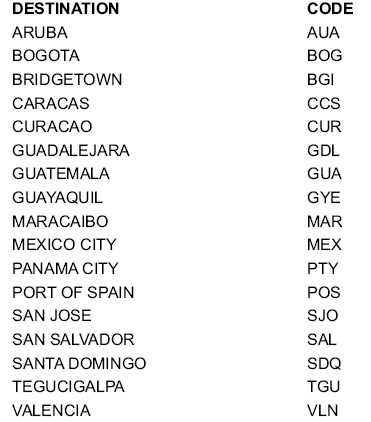
The height and width of the screenshot is (422, 371). I want to click on white empty space between columns, so click(x=206, y=387), click(x=208, y=231), click(x=201, y=67).